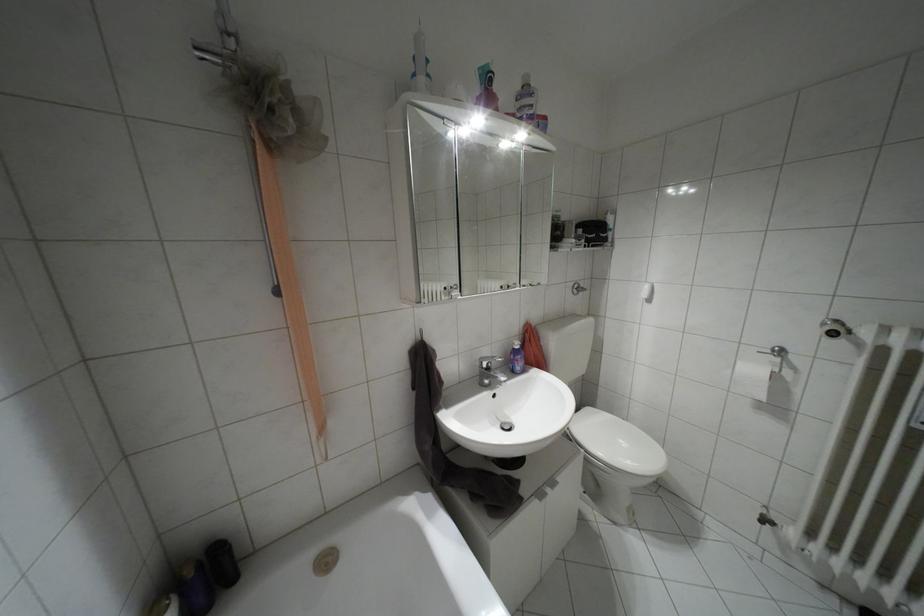
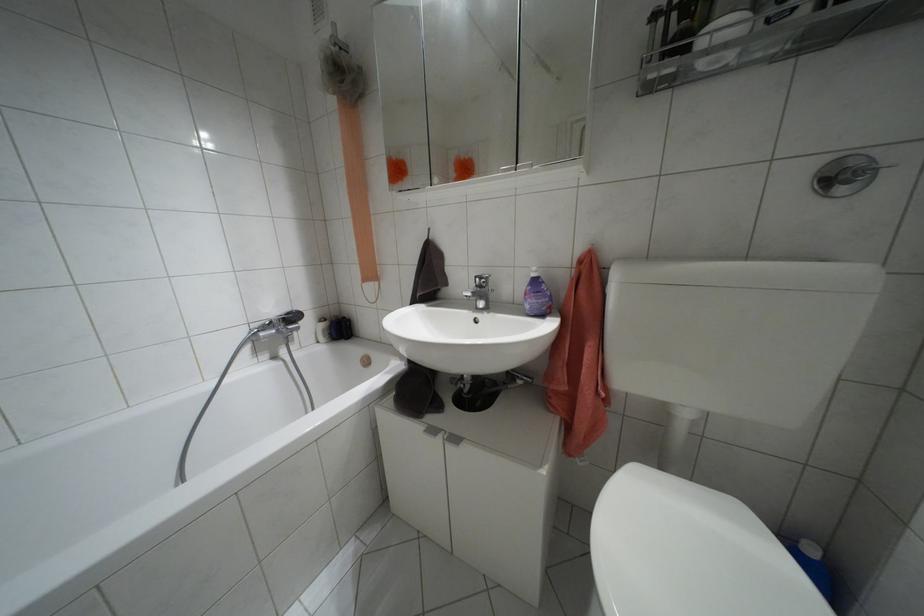
The point at (540, 493) is marked in the first image. Where is the corresponding point in the second image?

(432, 430)